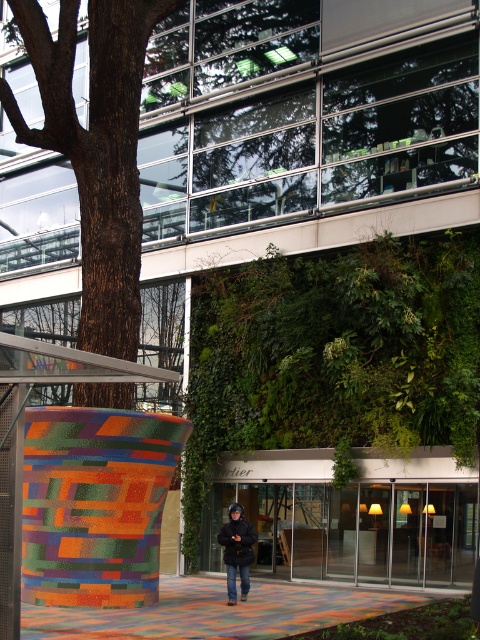
Question: Which point is closer to the camera?

Choices:
 (A) (217, 536)
 (B) (140, 266)

Answer: (B)

Question: Is brown rough bark tree at left above black matte jacket at center?

Choices:
 (A) no
 (B) yes

Answer: (B)

Question: Is brown rough bark tree at left thinner than black matte jacket at center?

Choices:
 (A) no
 (B) yes

Answer: (A)

Question: From the image, what is the correct spatial relationship of brown rough bark tree at left in relation to black matte jacket at center?

Choices:
 (A) left
 (B) right

Answer: (A)

Question: Which object is farther from the camera taking this photo?

Choices:
 (A) black matte jacket at center
 (B) brown rough bark tree at left

Answer: (A)